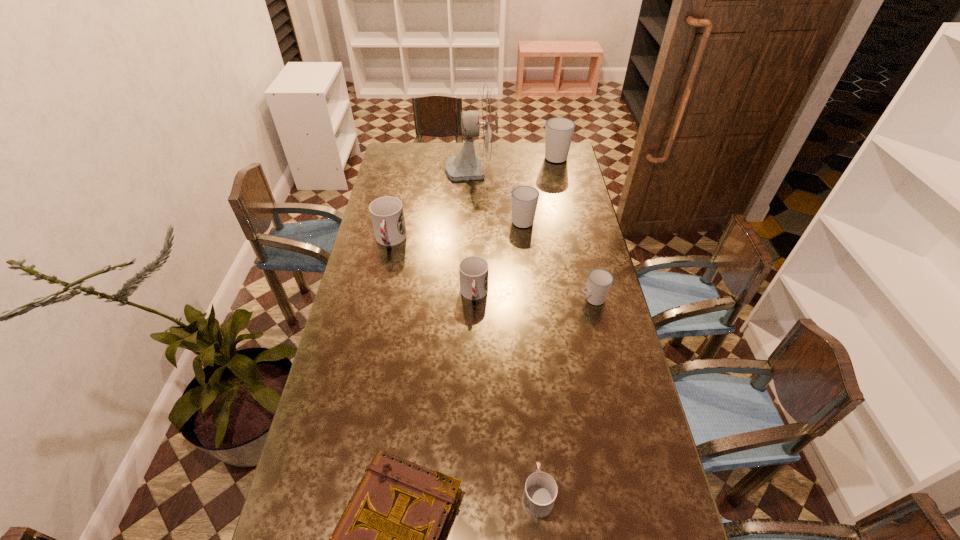
Where is `white fan`? The image size is (960, 540). white fan is located at coordinates (483, 123).

Locate an element on the screen. The height and width of the screenshot is (540, 960). the tallest object is located at coordinates (483, 123).

This screenshot has height=540, width=960. In order to click on the biggest white cup in this screenshot , I will do `click(559, 131)`.

Locate an element on the screen. the tallest cup is located at coordinates (559, 131).

At what (x,y) coordinates should I click in order to perform the action: click on the leftmost red cup. Please return your answer as a coordinate pair (x, y). The width and height of the screenshot is (960, 540). Looking at the image, I should click on (387, 215).

The width and height of the screenshot is (960, 540). I want to click on the leftmost cup, so click(x=387, y=215).

Where is `the second nearest white cup`? This screenshot has width=960, height=540. the second nearest white cup is located at coordinates (524, 199).

Identify the location of the second biggest white cup. (x=524, y=199).

At what (x,y) coordinates should I click in order to perform the action: click on the second farthest red cup. Please return your answer as a coordinate pair (x, y). Looking at the image, I should click on (473, 271).

The width and height of the screenshot is (960, 540). I want to click on the second biggest red cup, so click(x=473, y=271).